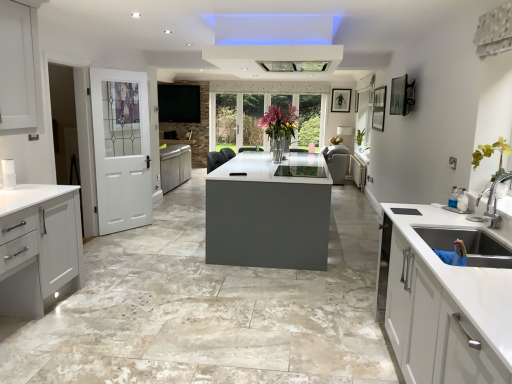
Question: From a real-world perspective, is matte white cabinet at left, placed as the 1th cabinetry when sorted from bottom to top, positioned under white glossy concrete at center based on gravity?

Choices:
 (A) yes
 (B) no

Answer: (B)

Question: Does matte white cabinet at left, which is the first cabinetry in left-to-right order, have a smaller size compared to white glossy concrete at center?

Choices:
 (A) no
 (B) yes

Answer: (B)

Question: Does matte white cabinet at left, placed as the 1th cabinetry when sorted from bottom to top, have a larger size compared to white glossy concrete at center?

Choices:
 (A) yes
 (B) no

Answer: (B)

Question: Is matte white cabinet at left, the second cabinetry positioned from the top, facing away from white glossy concrete at center?

Choices:
 (A) no
 (B) yes

Answer: (A)

Question: From the image's perspective, would you say matte white cabinet at left, arranged as the first cabinetry when viewed from the front, is positioned over white glossy concrete at center?

Choices:
 (A) yes
 (B) no

Answer: (B)

Question: Does matte white cabinet at left, placed as the 1th cabinetry when sorted from bottom to top, have a greater height compared to white glossy concrete at center?

Choices:
 (A) no
 (B) yes

Answer: (B)

Question: Is translucent glass vase at center surrounding white matte cabinet at center, the second cabinetry ordered from the bottom?

Choices:
 (A) no
 (B) yes

Answer: (A)

Question: From the image's perspective, is translucent glass vase at center beneath white matte cabinet at center, the 1th cabinetry in the right-to-left sequence?

Choices:
 (A) yes
 (B) no

Answer: (B)

Question: Is translucent glass vase at center at the right side of white matte cabinet at center, the second cabinetry ordered from the bottom?

Choices:
 (A) yes
 (B) no

Answer: (B)

Question: Can you confirm if translucent glass vase at center is taller than white matte cabinet at center, which appears as the second cabinetry when viewed from the left?

Choices:
 (A) no
 (B) yes

Answer: (B)

Question: Can you confirm if translucent glass vase at center is positioned to the left of white matte cabinet at center, the 1th cabinetry viewed from the top?

Choices:
 (A) no
 (B) yes

Answer: (B)

Question: Is translucent glass vase at center looking in the opposite direction of white matte cabinet at center, the second cabinetry ordered from the bottom?

Choices:
 (A) yes
 (B) no

Answer: (B)

Question: Considering the relative sizes of matte white cabinet at left, placed as the 1th cabinetry when sorted from bottom to top, and translucent glass vase at center in the image provided, is matte white cabinet at left, placed as the 1th cabinetry when sorted from bottom to top, taller than translucent glass vase at center?

Choices:
 (A) no
 (B) yes

Answer: (B)